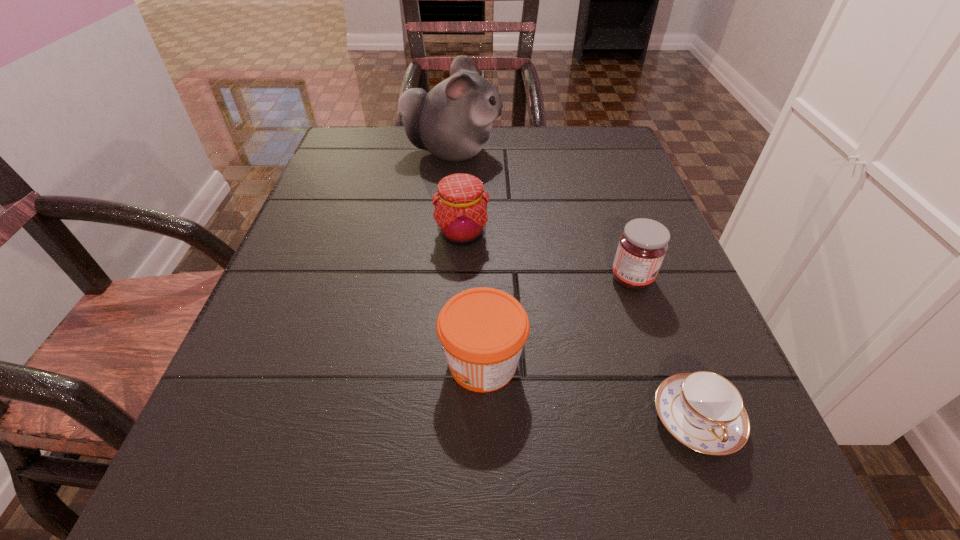
Find the location of `vacant space located on the front label of the nearest jam`. vacant space located on the front label of the nearest jam is located at coordinates (405, 363).

Image resolution: width=960 pixels, height=540 pixels. I want to click on free space located on the front label of the nearest jam, so click(x=291, y=363).

The height and width of the screenshot is (540, 960). Find the location of `vacant region located on the front label of the nearest jam`. vacant region located on the front label of the nearest jam is located at coordinates point(334,363).

Identify the location of object present at the far edge. (452, 121).

Where is `jam positioned at the right edge`? This screenshot has height=540, width=960. jam positioned at the right edge is located at coordinates (642, 246).

The width and height of the screenshot is (960, 540). Identify the location of teacup at the right edge. (703, 410).

This screenshot has height=540, width=960. In the image, there is a desktop. In order to click on vacant space at the far edge in this screenshot , I will do `click(516, 143)`.

This screenshot has width=960, height=540. What are the coordinates of `free space at the near edge` in the screenshot? It's located at (516, 480).

This screenshot has width=960, height=540. Identify the location of vacant space at the left edge of the desktop. (327, 233).

In the image, there is a desktop. Identify the location of vacant space at the right edge. (574, 181).